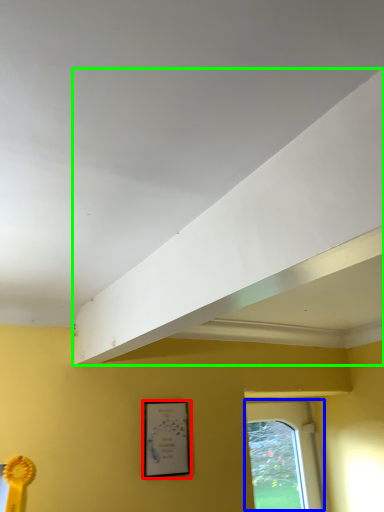
Question: Based on their relative distances, which object is farther from picture frame (highlighted by a red box)? Choose from window (highlighted by a blue box) and exhaust hood (highlighted by a green box).

Choices:
 (A) window
 (B) exhaust hood

Answer: (A)